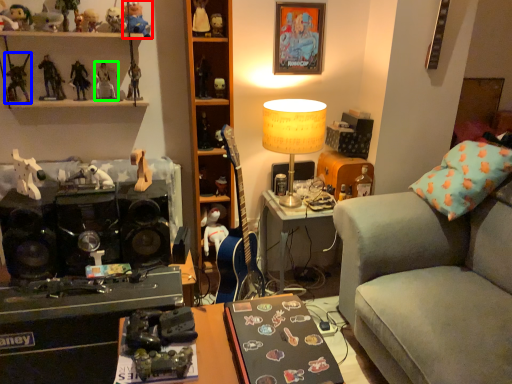
Question: Which object is the closest to the toy (highlighted by a red box)? Choose among these: toy (highlighted by a blue box) or toy (highlighted by a green box).

Choices:
 (A) toy
 (B) toy

Answer: (B)